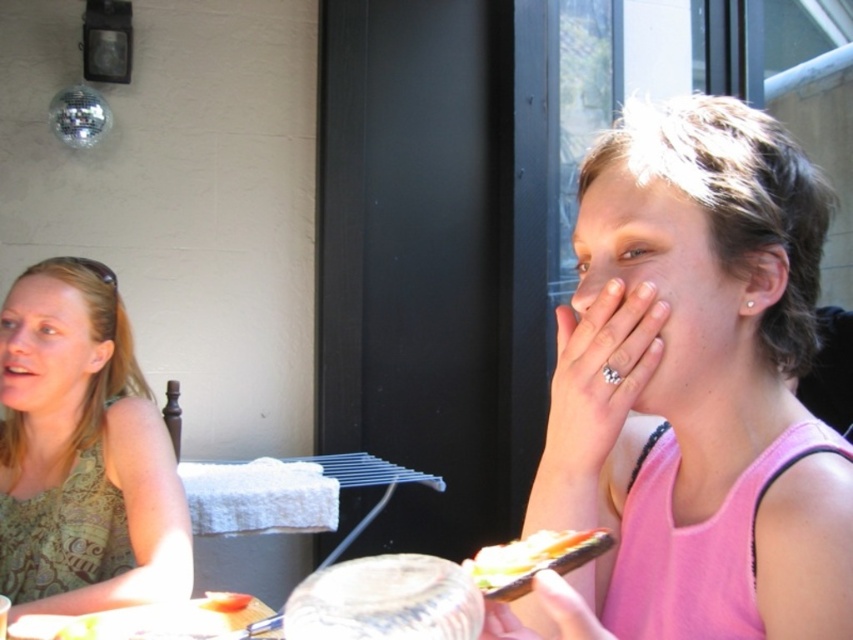
Question: Can you confirm if green patterned tank top at left is bigger than shiny plastic sandwich at lower center?

Choices:
 (A) no
 (B) yes

Answer: (B)

Question: Among these objects, which one is nearest to the camera?

Choices:
 (A) green patterned tank top at left
 (B) pink fabric tank top at right
 (C) smooth white bread at lower center

Answer: (B)

Question: Is green patterned tank top at left further to camera compared to smooth white bread at lower center?

Choices:
 (A) yes
 (B) no

Answer: (B)

Question: Estimate the real-world distances between objects in this image. Which object is closer to the pink fabric tank top at right?

Choices:
 (A) green patterned tank top at left
 (B) smooth white bread at lower center
 (C) shiny plastic sandwich at lower center

Answer: (C)

Question: Which of the following is the farthest from the observer?

Choices:
 (A) shiny plastic sandwich at lower center
 (B) green patterned tank top at left
 (C) smooth white bread at lower center

Answer: (C)

Question: Considering the relative positions of green patterned tank top at left and smooth white bread at lower center in the image provided, where is green patterned tank top at left located with respect to smooth white bread at lower center?

Choices:
 (A) right
 (B) left

Answer: (B)